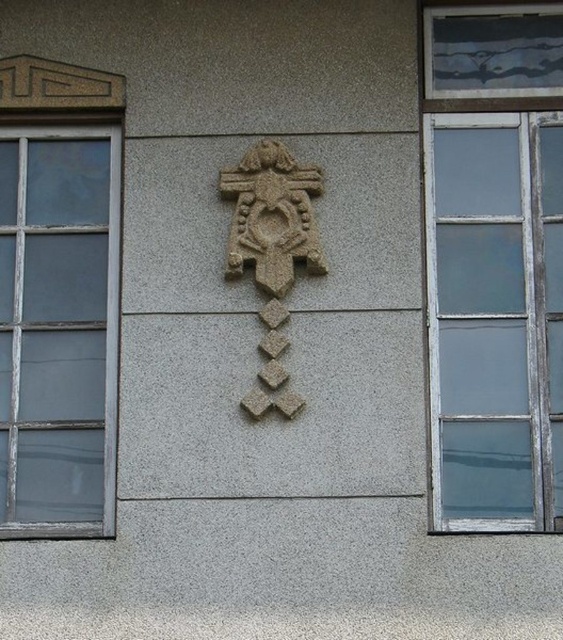
You are standing in front of the building and want to look through the clear glass window at right and the clear glass window at left. Which window should you look up to see?

The clear glass window at right is located above the clear glass window at left, so you should look up to see the clear glass window at right.

You are standing in front of the building and notice two points on the wall. The first point is at coordinates point [470,250] and the second is at point [287,193]. Which point is closer to you?

Point [470,250] is further to the viewer than point [287,193], so the second point is closer to you.

You are standing in front of the building and notice the clear glass window at right and the granite stone cross at center. Which object is located higher up on the wall?

The clear glass window at right is positioned over the granite stone cross at center, so it is located higher up on the wall.